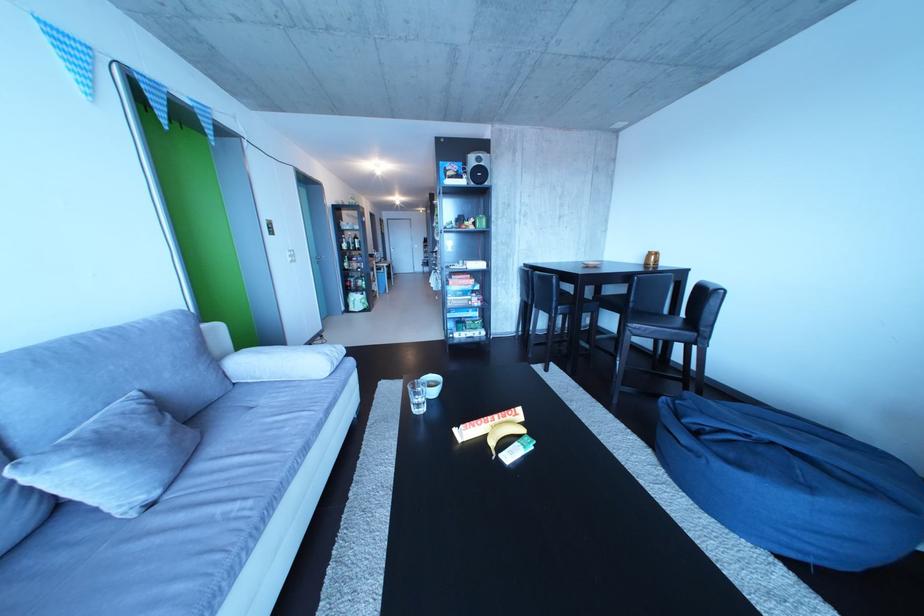
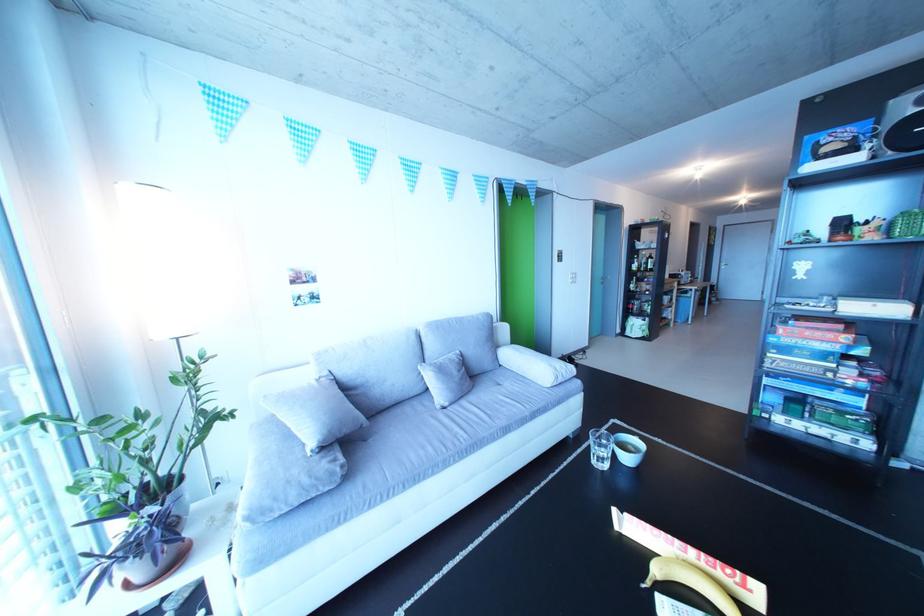
Question: How did the camera likely rotate?

Choices:
 (A) Left
 (B) Right
 (C) Up
 (D) Down

Answer: (A)